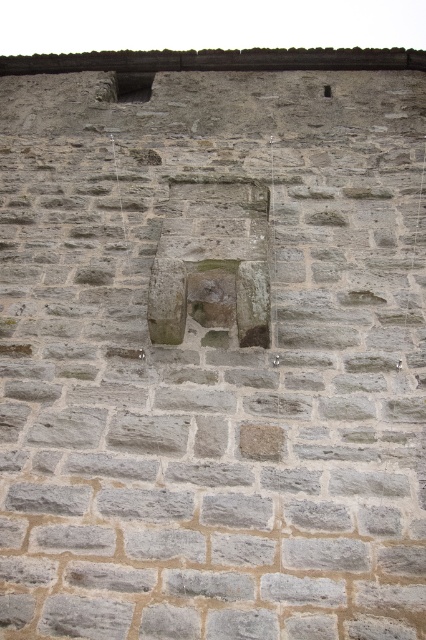
You are an architect examining the stone wall and need to install a new support beam. The beam must be placed below the matte stone window at upper left. Where should you position it in relation to the gray stone hole at upper center?

The matte stone window at upper left is located above the gray stone hole at upper center, so the support beam should be positioned below the matte stone window at upper left and above the gray stone hole at upper center.

You are an architect examining the stone wall and need to determine the relative sizes of two features. Which object is taller between the matte stone window at upper left and the gray stone hole at upper center?

The matte stone window at upper left is taller than the gray stone hole at upper center according to the description.

You are an archaeologist examining the stone wall. You notice the matte stone window at upper left and the gray stone hole at upper center. Which feature is closer to your current position?

The matte stone window at upper left is closer to your current position because it is further to the viewer than the gray stone hole at upper center.